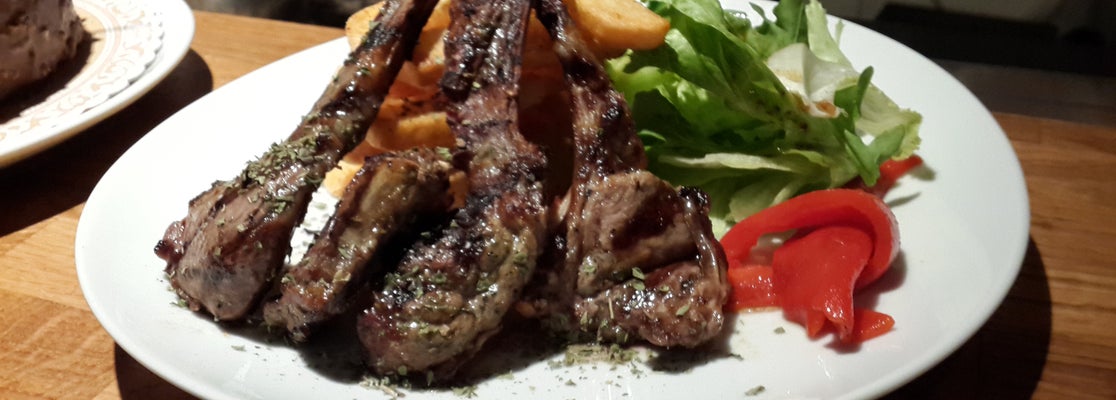
You are a GUI agent. You are given a task and a screenshot of the screen. Output one action in this format:
    pyautogui.click(x=<x>, y=<y>)
    Task: Click on the plate
    The width and height of the screenshot is (1116, 400).
    Given the screenshot: What is the action you would take?
    pyautogui.click(x=966, y=275)